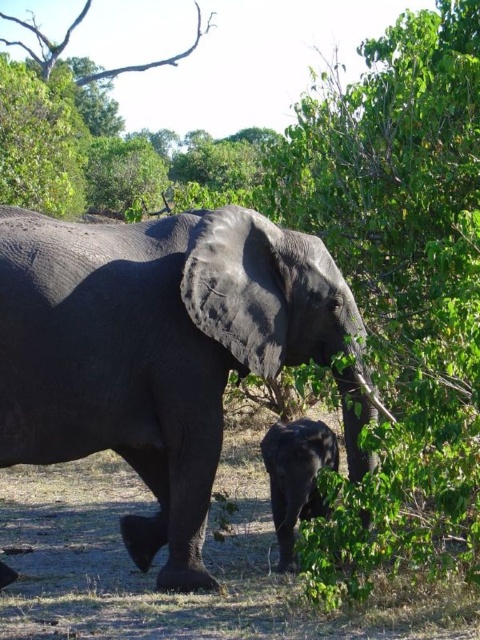
You are a wildlife photographer trying to capture a photo of both the gray textured elephant at center and the dark gray elephant at lower center. Since you want to ensure both are in focus, you need to know which one is taller. Can you determine which elephant is taller?

The gray textured elephant at center is taller than the dark gray elephant at lower center according to the description.

Consider the image. You are an observer standing in front of the two elephants. Which elephant, the gray textured elephant at center or the dark gray elephant at lower center, is positioned closer to you?

The gray textured elephant at center is closer to the viewer than the dark gray elephant at lower center.